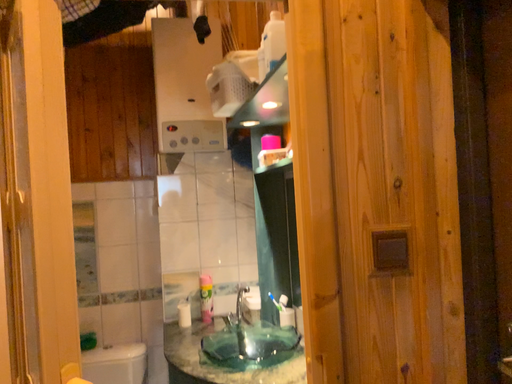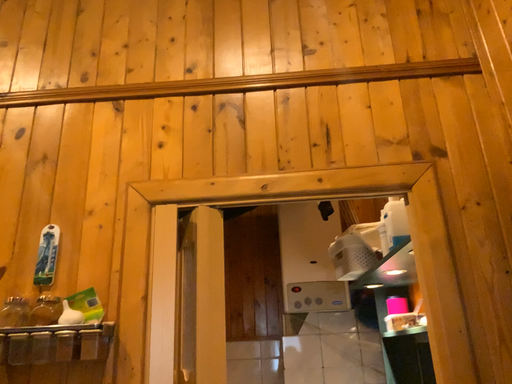
Question: How did the camera likely rotate when shooting the video?

Choices:
 (A) rotated left
 (B) rotated right

Answer: (A)